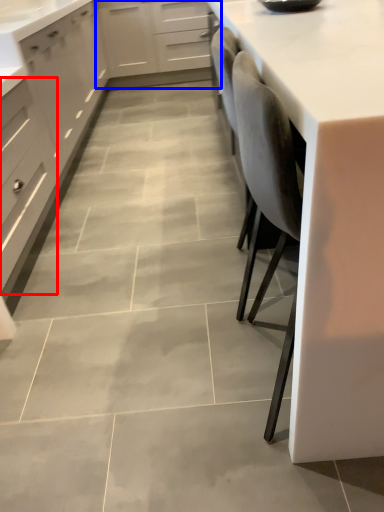
Question: Which of the following is the closest to the observer, drawer (highlighted by a red box) or cabinetry (highlighted by a blue box)?

Choices:
 (A) drawer
 (B) cabinetry

Answer: (A)